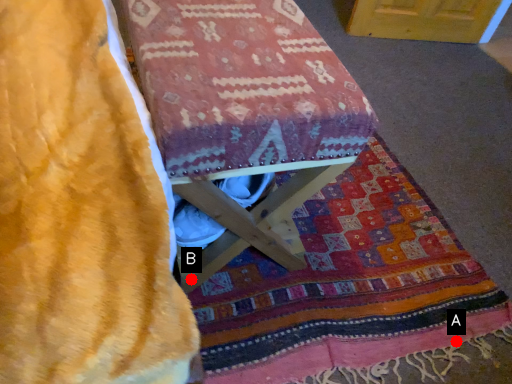
Question: Two points are circled on the image, labeled by A and B beside each circle. Which point is closer to the camera taking this photo?

Choices:
 (A) A is closer
 (B) B is closer

Answer: (B)